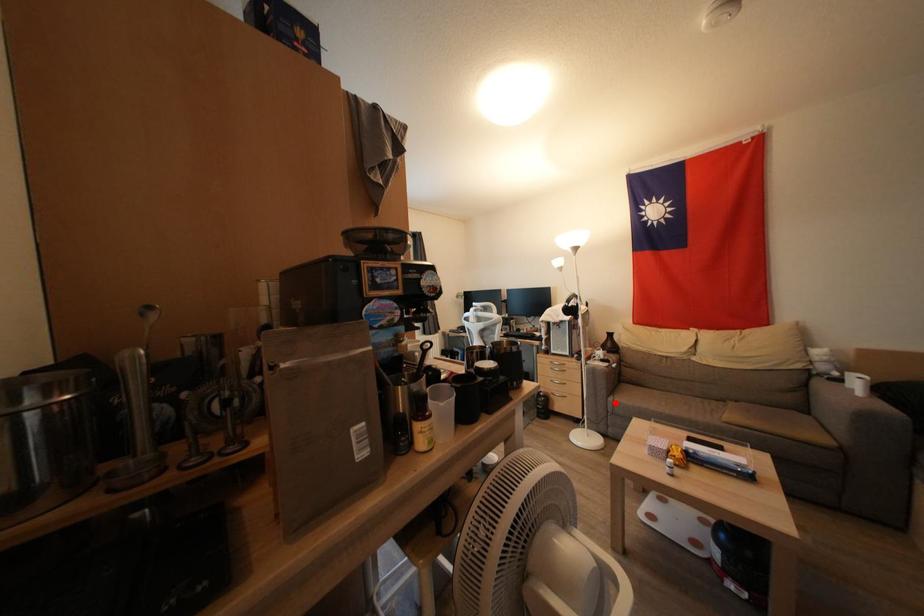
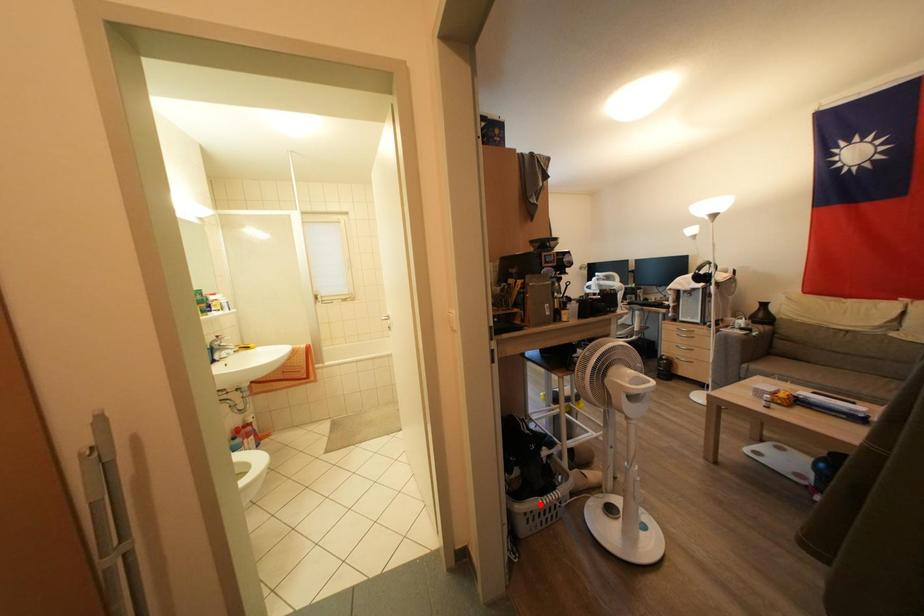
I am providing you with two images of the same scene from different viewpoints. A red point is marked on the first image and another point is marked on the second image. Is the red point in image1 aligned with the point shown in image2?

Answer: No